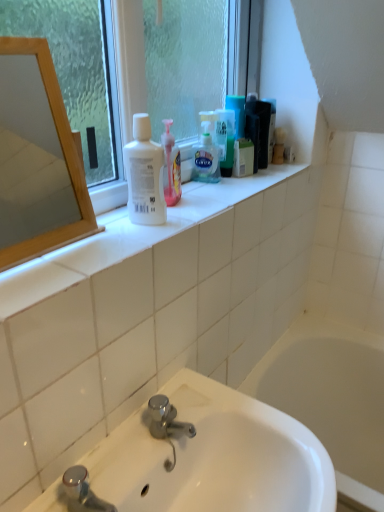
Question: From the image's perspective, is translucent plastic shaving cream at center located above or below wooden mirror at left?

Choices:
 (A) above
 (B) below

Answer: (A)

Question: Is translucent plastic shaving cream at center in front of or behind wooden mirror at left in the image?

Choices:
 (A) front
 (B) behind

Answer: (B)

Question: Which is nearer to the white glossy sink at lower center?

Choices:
 (A) clear glass window at upper center
 (B) translucent plastic shaving cream at center
 (C) white matte bottle at upper center
 (D) green matte box at upper center
 (E) wooden mirror at left

Answer: (C)

Question: Estimate the real-world distances between objects in this image. Which object is farther from the white matte bottle at upper center?

Choices:
 (A) green matte box at upper center
 (B) clear glass window at upper center
 (C) translucent plastic shaving cream at center
 (D) white glossy sink at lower center
 (E) wooden mirror at left

Answer: (E)